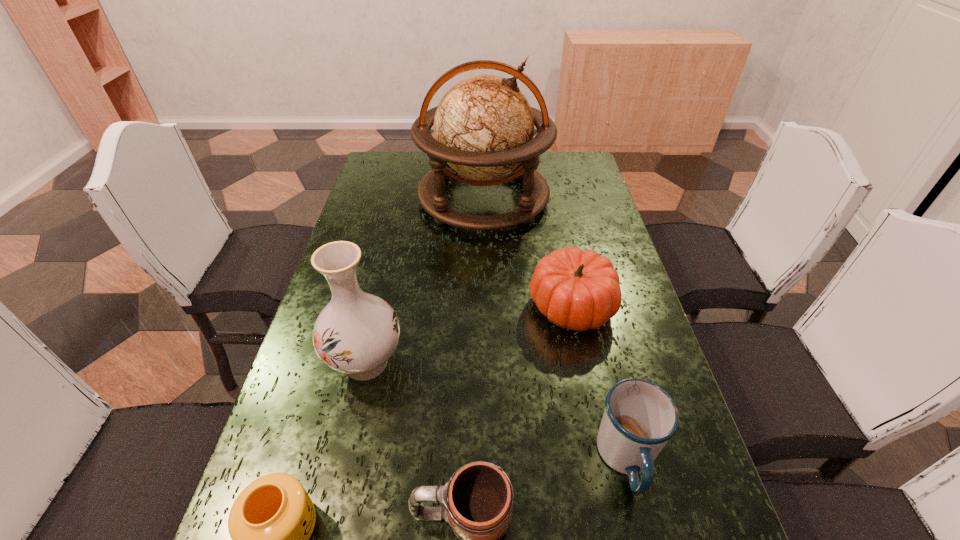
Choose which mug is the second nearest neighbor to the pumpkin. Please provide its 2D coordinates. Your answer should be formatted as a tuple, i.e. [(x, y)], where the tuple contains the x and y coordinates of a point satisfying the conditions above.

[(479, 502)]